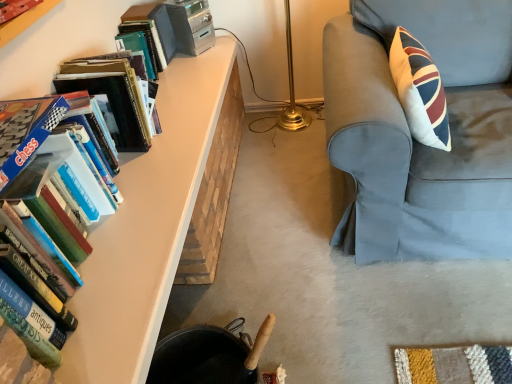
Question: From a real-world perspective, is matte white table at left located higher than hardcover book at upper left, which is the second book in front-to-back order?

Choices:
 (A) yes
 (B) no

Answer: (B)

Question: Can you confirm if matte white table at left is wider than hardcover book at upper left, which is the first book in top-to-bottom order?

Choices:
 (A) no
 (B) yes

Answer: (B)

Question: Would you say matte white table at left is a long distance from hardcover book at upper left, positioned as the 1th book in back-to-front order?

Choices:
 (A) no
 (B) yes

Answer: (A)

Question: From a real-world perspective, is matte white table at left physically below hardcover book at upper left, which is the first book in top-to-bottom order?

Choices:
 (A) yes
 (B) no

Answer: (A)

Question: Does matte white table at left turn towards hardcover book at upper left, positioned as the 1th book in back-to-front order?

Choices:
 (A) no
 (B) yes

Answer: (A)

Question: Is light blue fabric chair at right spatially inside matte white table at left, or outside of it?

Choices:
 (A) inside
 (B) outside

Answer: (B)

Question: Based on their sizes in the image, would you say light blue fabric chair at right is bigger or smaller than matte white table at left?

Choices:
 (A) small
 (B) big

Answer: (B)

Question: Is point (x=349, y=66) positioned closer to the camera than point (x=185, y=150)?

Choices:
 (A) closer
 (B) farther

Answer: (A)

Question: Looking at their shapes, would you say light blue fabric chair at right is wider or thinner than matte white table at left?

Choices:
 (A) thin
 (B) wide

Answer: (B)

Question: Considering the positions of matte plastic bookcase at upper left and matte white table at left in the image, is matte plastic bookcase at upper left bigger or smaller than matte white table at left?

Choices:
 (A) big
 (B) small

Answer: (B)

Question: Is matte plastic bookcase at upper left taller or shorter than matte white table at left?

Choices:
 (A) short
 (B) tall

Answer: (B)

Question: In terms of width, does matte plastic bookcase at upper left look wider or thinner when compared to matte white table at left?

Choices:
 (A) thin
 (B) wide

Answer: (A)

Question: Relative to matte white table at left, is matte plastic bookcase at upper left in front or behind?

Choices:
 (A) front
 (B) behind

Answer: (A)

Question: Based on their sizes in the image, would you say hardcover books at left, positioned as the 1th book in bottom-to-top order, is bigger or smaller than matte plastic bookcase at upper left?

Choices:
 (A) big
 (B) small

Answer: (A)

Question: Based on their positions, is hardcover books at left, which appears as the 2th book when viewed from the back, located to the left or right of matte plastic bookcase at upper left?

Choices:
 (A) left
 (B) right

Answer: (B)